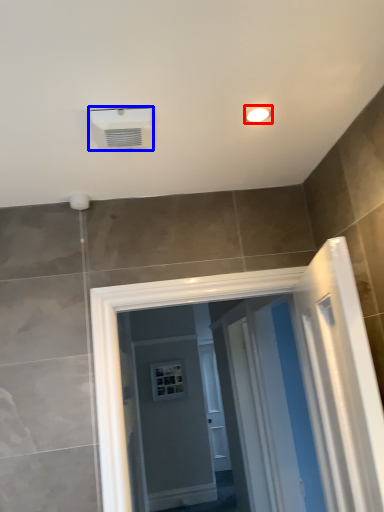
Question: Which point is closer to the camera, light fixture (highlighted by a red box) or air conditioning (highlighted by a blue box)?

Choices:
 (A) light fixture
 (B) air conditioning

Answer: (B)